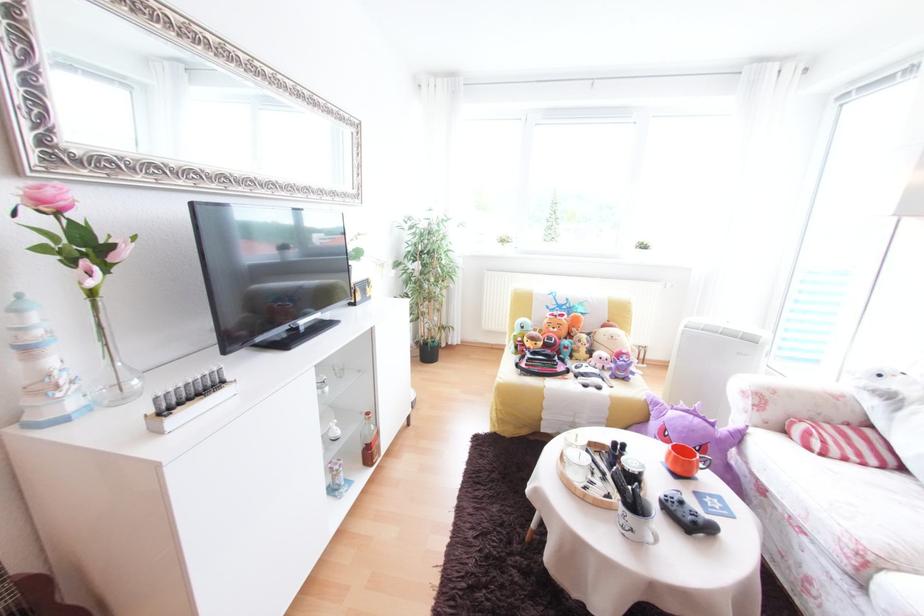
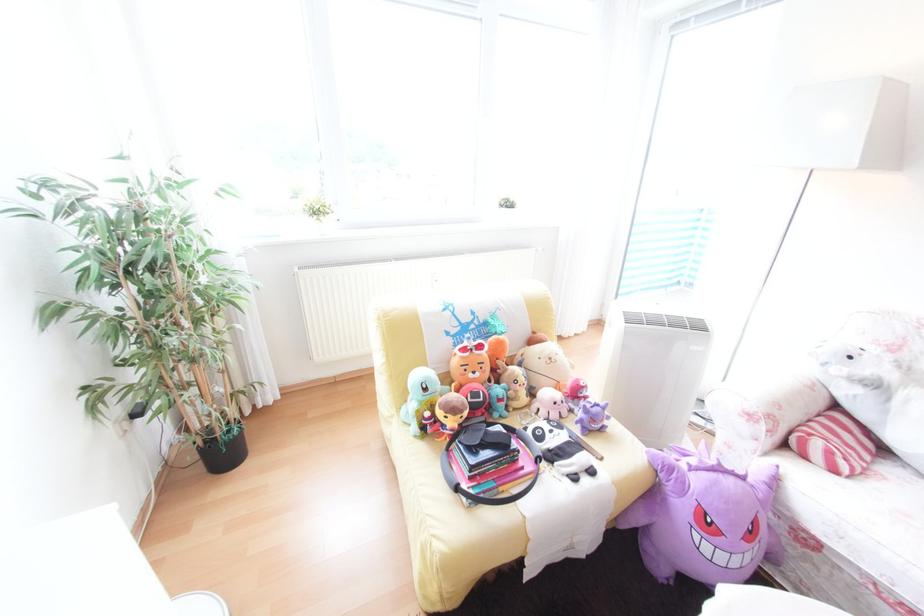
The point at (549, 342) is marked in the first image. Where is the corresponding point in the second image?

(476, 408)